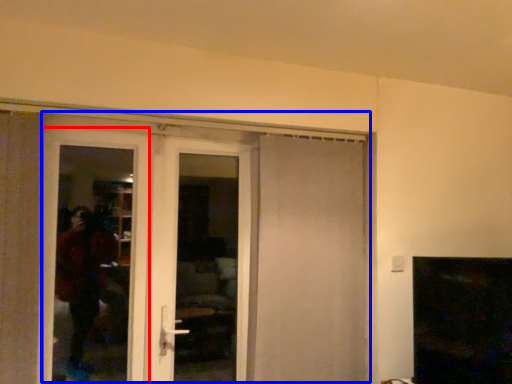
Question: Which object is closer to the camera taking this photo, screen door (highlighted by a red box) or door (highlighted by a blue box)?

Choices:
 (A) screen door
 (B) door

Answer: (B)